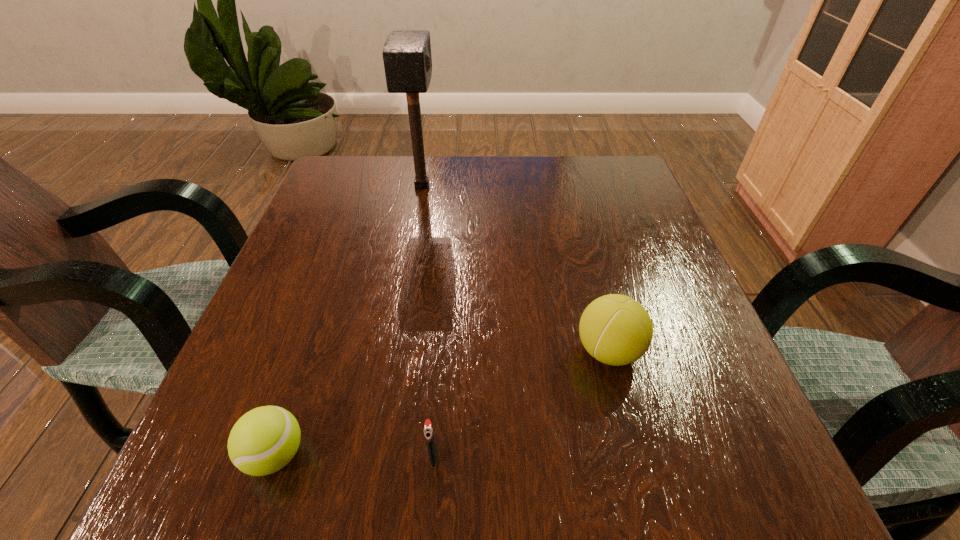
Where is `free spot between the shorter tennis ball and the second object from left to right`? This screenshot has height=540, width=960. free spot between the shorter tennis ball and the second object from left to right is located at coordinates click(348, 320).

In order to click on free space between the second object from right to left and the nearer tennis ball in this screenshot , I will do (354, 456).

Image resolution: width=960 pixels, height=540 pixels. Find the location of `vacant area between the third object from right to left and the rightmost object`. vacant area between the third object from right to left and the rightmost object is located at coordinates (516, 268).

This screenshot has height=540, width=960. Identify the location of free point between the second object from left to right and the right tennis ball. (516, 268).

In order to click on object that ranks as the closest to the tallest object in this screenshot , I will do `click(617, 330)`.

Find the location of `object that is the nearest to the igniter`. object that is the nearest to the igniter is located at coordinates (264, 440).

The width and height of the screenshot is (960, 540). In order to click on free location that satisfies the following two spatial constraints: 1. on the back side of the shorter tennis ball; 2. on the left side of the farther tennis ball in this screenshot , I will do `click(311, 351)`.